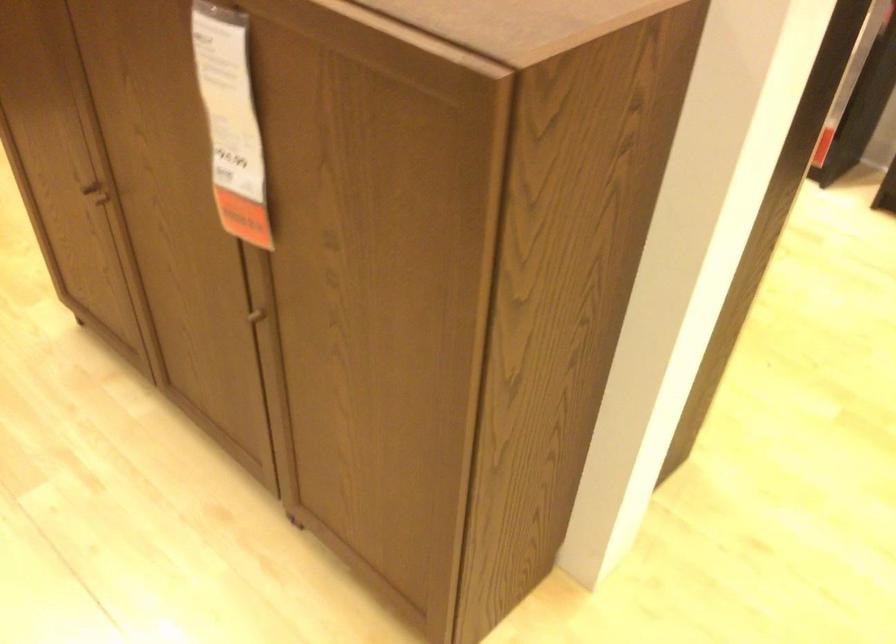
The location [230,122] corresponds to which object?

It refers to a white price tag.